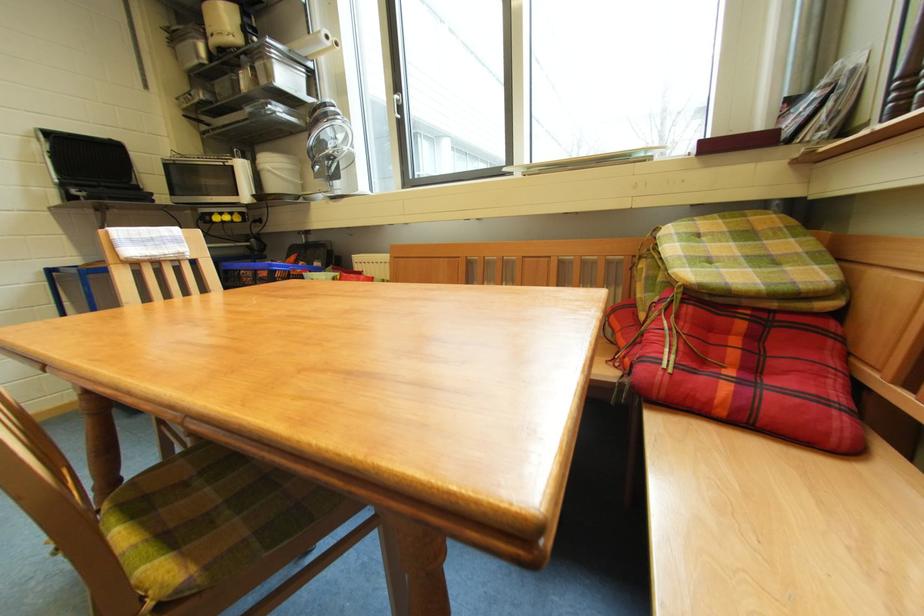
Where is `black grill handle`? The image size is (924, 616). black grill handle is located at coordinates (91, 168).